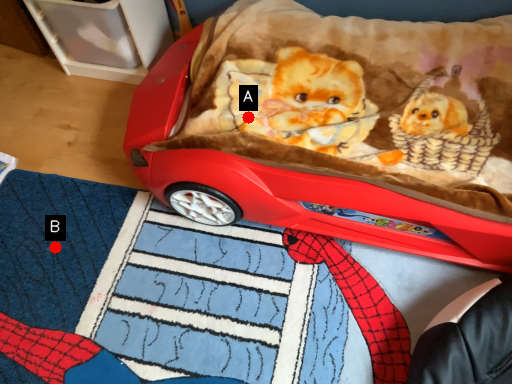
Question: Two points are circled on the image, labeled by A and B beside each circle. Which of the following is the farthest from the observer?

Choices:
 (A) A is further
 (B) B is further

Answer: (B)